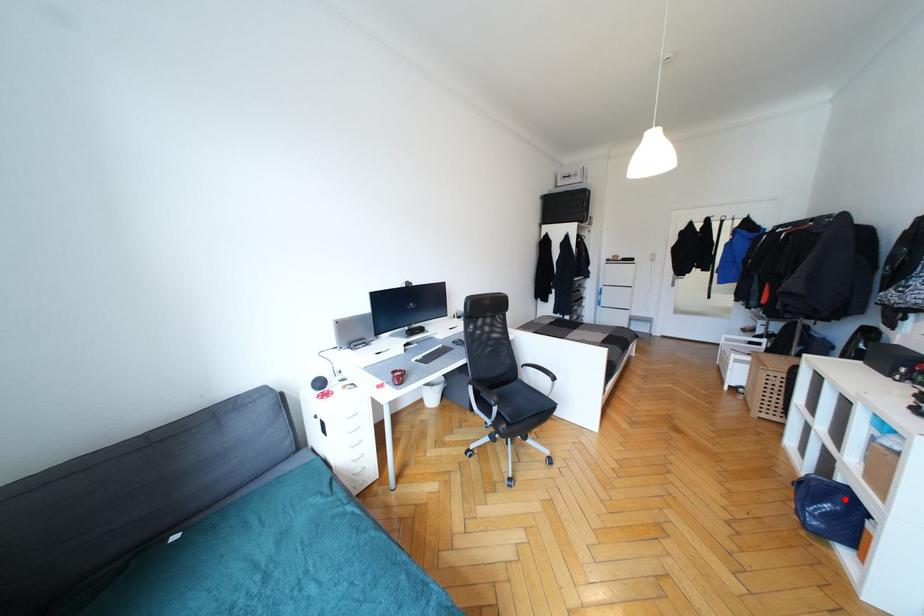
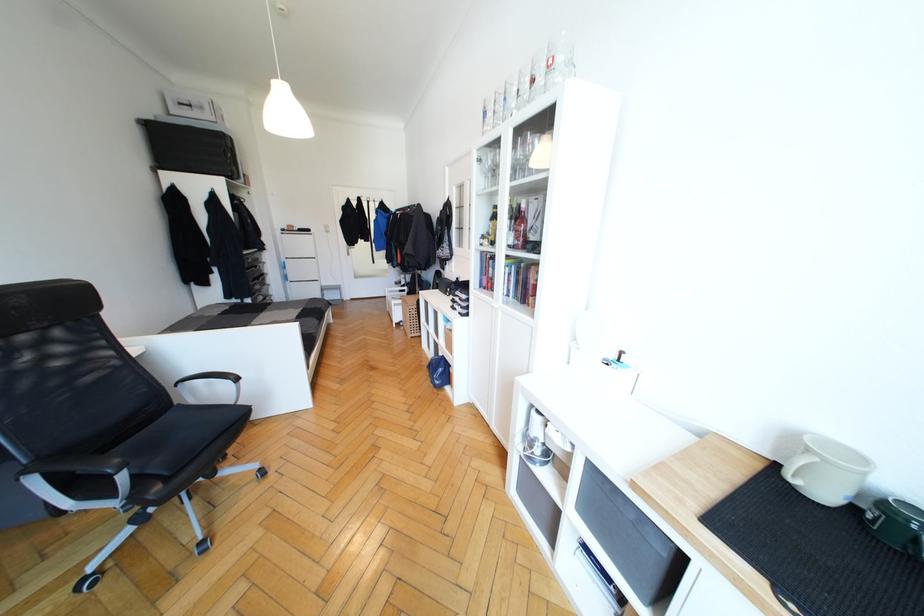
Locate, in the second image, the point that corresponds to the highlighted location in the first image.

(445, 363)